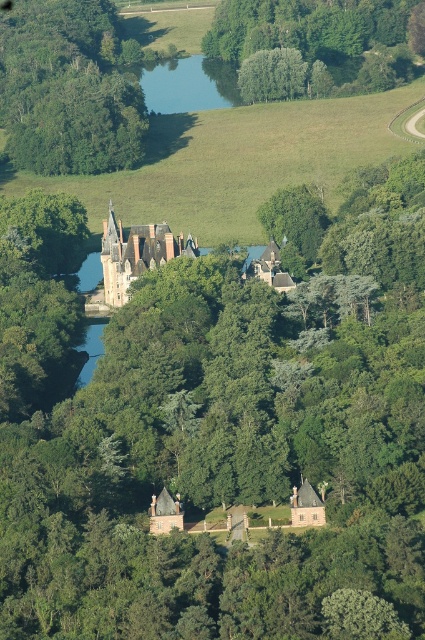
You are a drone operator tasked with capturing aerial footage of the brown stone castle at center. Your drone is currently at point A, which is located at coordinates north of the castle. You need to adjust your drone to the exact location of the castle to get the best shot. In which cardinal direction should you move your drone from its current position to reach the castle?

The brown stone castle at center is located at point north of the drone, so you should move your drone south to reach the castle.

You are a tourist standing at the entrance of the chateau grounds. You see the brown stone castle at center and the brown wooden house at center. Which structure is taller?

The brown stone castle at center is taller than the brown wooden house at center.

Consider the image. You are a drone operator flying over the chateau. You need to deliver a package to the brown wooden house at center. However, there is a green leafy tree at upper center in the way. Can you safely fly your drone through the space between them?

The green leafy tree at upper center is larger than the brown wooden house at center. Therefore, the space between them may be too narrow for the drone to pass safely. It is recommended to choose a different route to ensure the drone can navigate without obstruction.